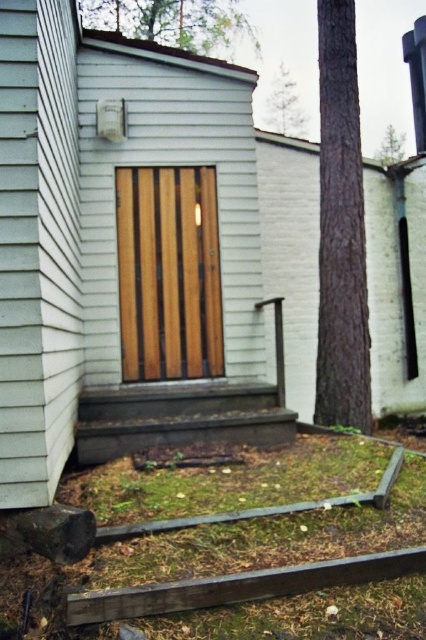
You are standing in front of the house and want to place a small potted plant between the two points marked as point (115, 432) and point (273, 77). Which point should the plant be closer to in order to be nearer to the viewer?

The plant should be closer to point (115, 432) because it is nearer to the viewer compared to point (273, 77).

You are standing at the point marked as point (178,417) and want to reach the wooden door with vertical slats. Which direction should you move to get closer to the door?

The point (178,417) is located on the brown wooden stairs at lower center. To reach the wooden door with vertical slats, you should move upward along the stairs towards the door.